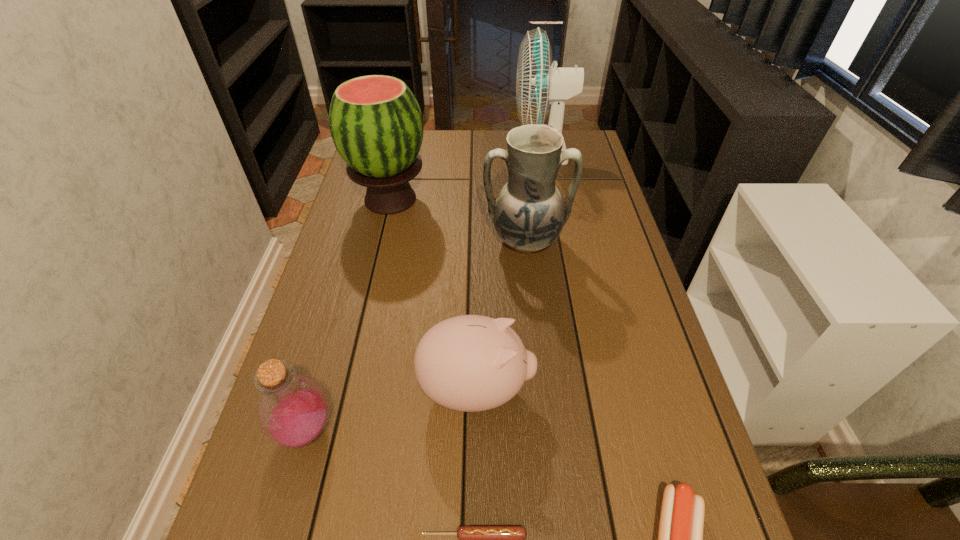
Locate an element on the screen. free point located on the right of the bottle is located at coordinates (405, 430).

Identify the location of vacant area situated at the snout of the piggy bank. (576, 389).

Where is `object at the far edge`? The image size is (960, 540). object at the far edge is located at coordinates (538, 84).

The image size is (960, 540). I want to click on watermelon located at the left edge, so click(x=375, y=121).

The width and height of the screenshot is (960, 540). In order to click on bottle situated at the left edge in this screenshot , I will do `click(293, 410)`.

This screenshot has width=960, height=540. I want to click on fan located at the right edge, so click(538, 84).

In order to click on pitcher positioned at the right edge in this screenshot , I will do `click(529, 213)`.

Locate an element on the screen. object present at the far right corner is located at coordinates (538, 84).

Locate an element on the screen. Image resolution: width=960 pixels, height=540 pixels. free space at the far edge is located at coordinates (438, 152).

In order to click on free space at the left edge of the desktop in this screenshot , I will do `click(348, 236)`.